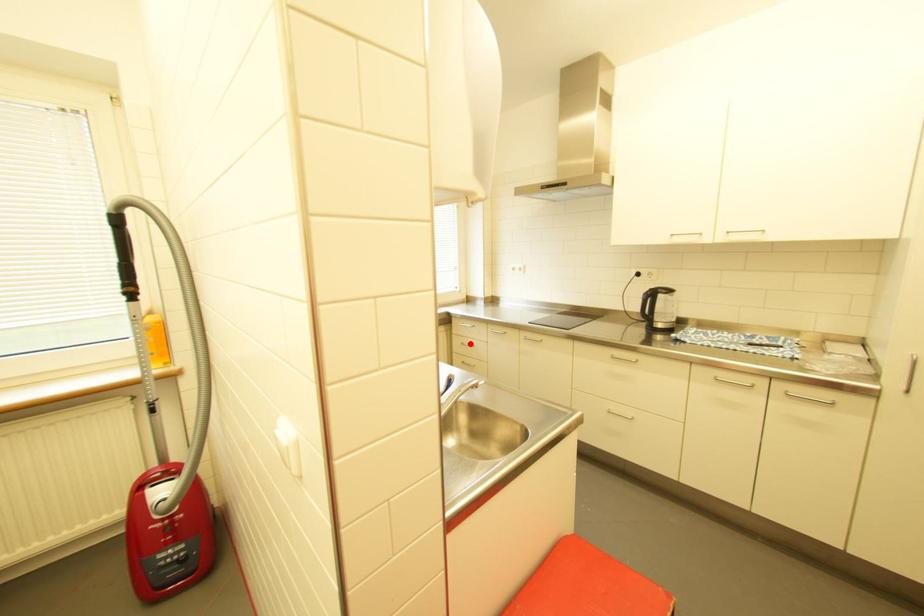
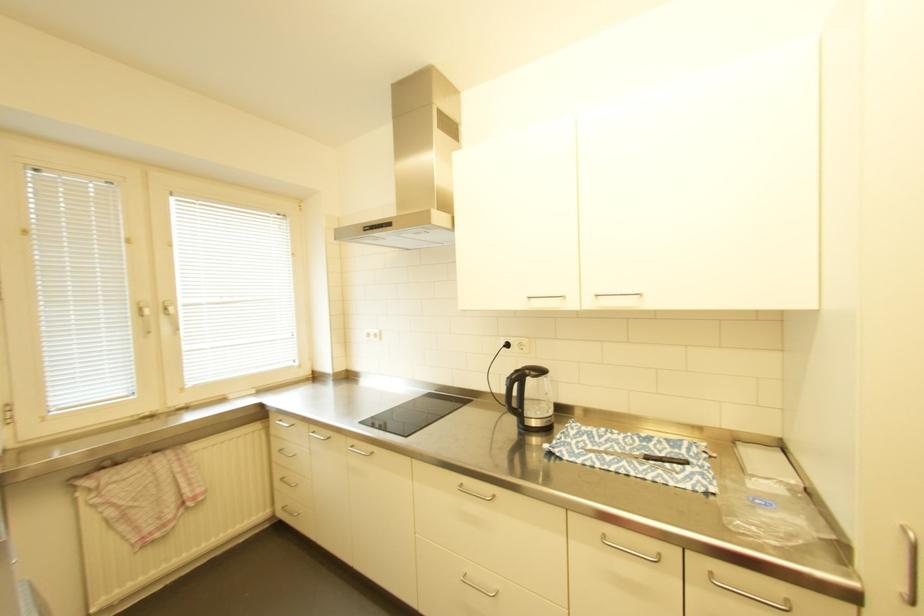
Question: I am providing you with two images of the same scene from different viewpoints. In image1, a red point is highlighted. Considering the same 3D point in image2, which of the following is correct?

Choices:
 (A) It is closer
 (B) It is farther

Answer: (B)